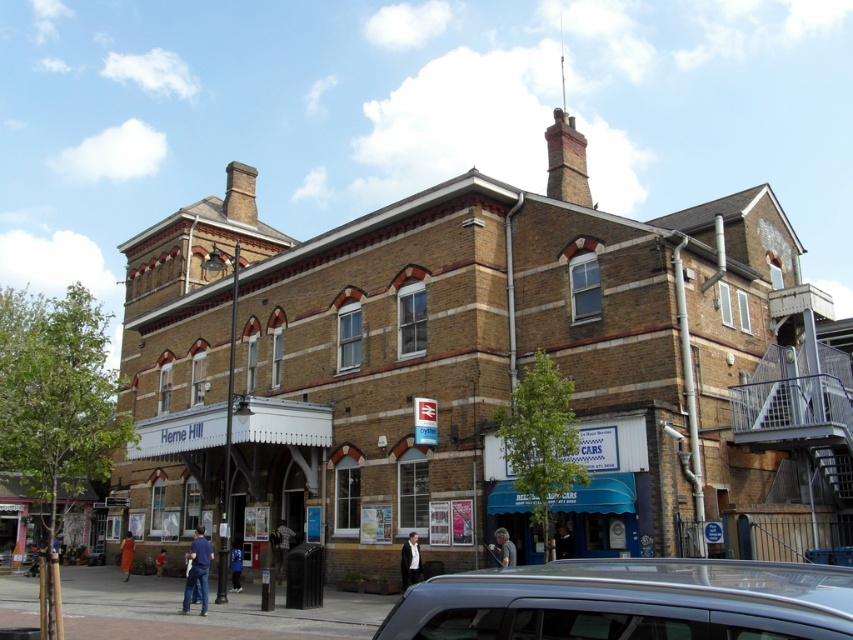
Between silver metallic car at lower right and blue matte awning at lower center, which one appears on the left side from the viewer's perspective?

From the viewer's perspective, silver metallic car at lower right appears more on the left side.

Consider the image. Does silver metallic car at lower right have a smaller size compared to blue matte awning at lower center?

Incorrect, silver metallic car at lower right is not smaller in size than blue matte awning at lower center.

This screenshot has width=853, height=640. In order to click on silver metallic car at lower right in this screenshot , I will do `click(630, 602)`.

Is silver metallic car at lower right closer to the viewer compared to white wooden awning at center?

Yes.

Does point (535, 576) lie in front of point (149, 432)?

That is True.

This screenshot has width=853, height=640. I want to click on silver metallic car at lower right, so click(630, 602).

Image resolution: width=853 pixels, height=640 pixels. I want to click on silver metallic car at lower right, so point(630,602).

Which is below, blue matte awning at lower center or white wooden awning at center?

white wooden awning at center is lower down.

Where is `blue matte awning at lower center`? blue matte awning at lower center is located at coordinates (610, 490).

Who is more distant from viewer, (608,531) or (252,493)?

Positioned behind is point (252,493).

Find the location of a particular element. blue matte awning at lower center is located at coordinates (610, 490).